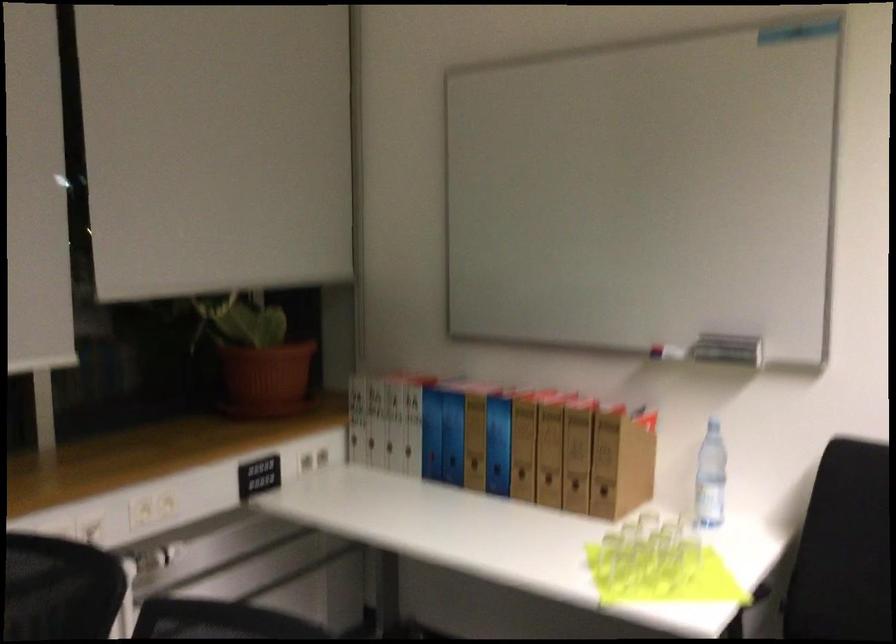
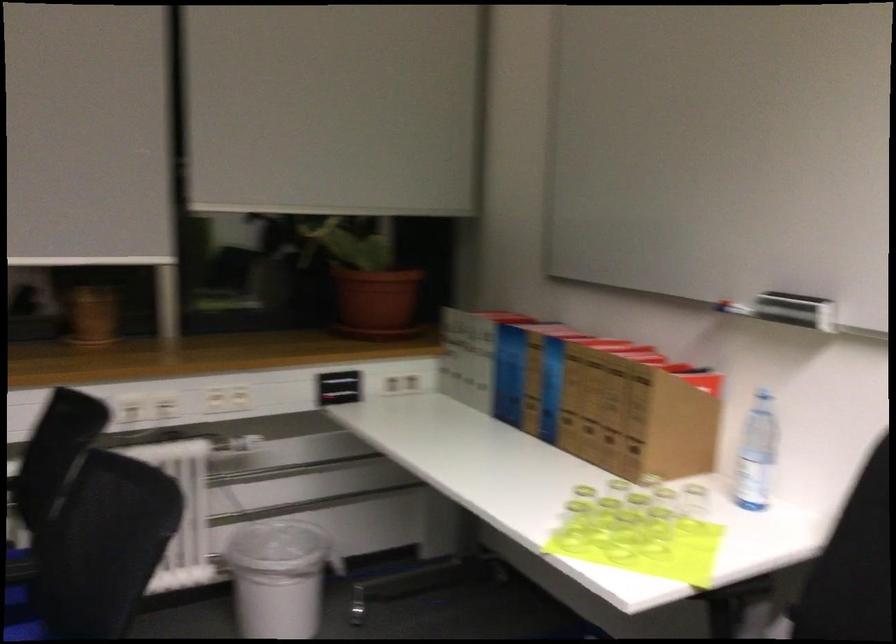
Question: How did the camera likely rotate?

Choices:
 (A) Left
 (B) Right
 (C) Up
 (D) Down

Answer: (A)